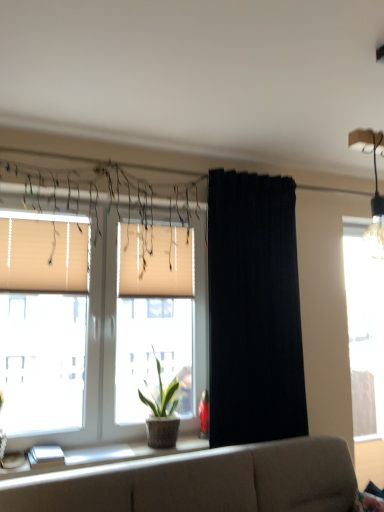
Question: Is white glossy window sill at lower left outside of white pleated blinds at center, acting as the second window blind starting from the front?

Choices:
 (A) no
 (B) yes

Answer: (B)

Question: Can you confirm if white glossy window sill at lower left is bigger than white pleated blinds at center, acting as the second window blind starting from the front?

Choices:
 (A) yes
 (B) no

Answer: (B)

Question: Does white glossy window sill at lower left have a greater height compared to white pleated blinds at center, acting as the first window blind starting from the right?

Choices:
 (A) no
 (B) yes

Answer: (A)

Question: Does white glossy window sill at lower left have a smaller size compared to white pleated blinds at center, acting as the first window blind starting from the right?

Choices:
 (A) yes
 (B) no

Answer: (A)

Question: Is white pleated blinds at center, acting as the first window blind starting from the right, at the back of white glossy window sill at lower left?

Choices:
 (A) no
 (B) yes

Answer: (A)

Question: In terms of height, does white pleated blinds at center, acting as the second window blind starting from the front, look taller or shorter compared to transparent glass window at right, arranged as the 2th window when viewed from the left?

Choices:
 (A) tall
 (B) short

Answer: (B)

Question: Is white pleated blinds at center, the first window blind viewed from the back, to the left or to the right of transparent glass window at right, the second window viewed from the front, in the image?

Choices:
 (A) right
 (B) left

Answer: (B)

Question: Does point (152, 240) appear closer or farther from the camera than point (364, 270)?

Choices:
 (A) closer
 (B) farther

Answer: (A)

Question: From a real-world perspective, is white pleated blinds at center, the first window blind viewed from the back, physically located above or below transparent glass window at right, the second window viewed from the front?

Choices:
 (A) below
 (B) above

Answer: (B)

Question: From a real-world perspective, is beige fabric window at center, the 2th window in the back-to-front sequence, positioned above or below green leafy plant in woven pot at window?

Choices:
 (A) above
 (B) below

Answer: (A)

Question: From the image's perspective, is beige fabric window at center, the 2th window in the back-to-front sequence, above or below green leafy plant in woven pot at window?

Choices:
 (A) below
 (B) above

Answer: (B)

Question: Considering the positions of beige fabric window at center, the 1th window when ordered from front to back, and green leafy plant in woven pot at window in the image, is beige fabric window at center, the 1th window when ordered from front to back, wider or thinner than green leafy plant in woven pot at window?

Choices:
 (A) thin
 (B) wide

Answer: (A)

Question: Is point (201, 288) closer or farther from the camera than point (167, 439)?

Choices:
 (A) closer
 (B) farther

Answer: (B)

Question: In terms of height, does black fabric curtain at center look taller or shorter compared to white glossy window sill at lower left?

Choices:
 (A) tall
 (B) short

Answer: (A)

Question: Is black fabric curtain at center inside or outside of white glossy window sill at lower left?

Choices:
 (A) inside
 (B) outside

Answer: (B)